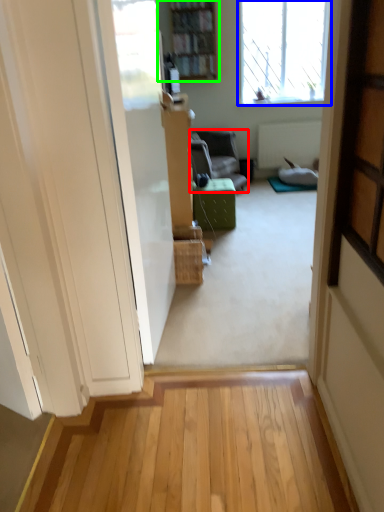
Question: Estimate the real-world distances between objects in this image. Which object is closer to furniture (highlighted by a red box), window (highlighted by a blue box) or bookcase (highlighted by a green box)?

Choices:
 (A) window
 (B) bookcase

Answer: (B)